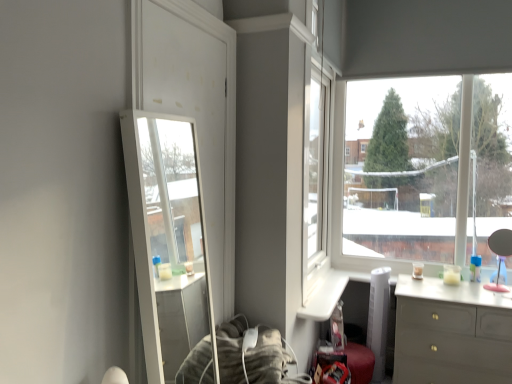
Question: Is clear glass mirror at left positioned far away from matte gray dresser at lower right?

Choices:
 (A) no
 (B) yes

Answer: (B)

Question: From the image's perspective, is clear glass mirror at left over matte gray dresser at lower right?

Choices:
 (A) no
 (B) yes

Answer: (B)

Question: Is clear glass mirror at left to the left of matte gray dresser at lower right from the viewer's perspective?

Choices:
 (A) yes
 (B) no

Answer: (A)

Question: Is clear glass mirror at left taller than matte gray dresser at lower right?

Choices:
 (A) yes
 (B) no

Answer: (A)

Question: Is clear glass mirror at left behind matte gray dresser at lower right?

Choices:
 (A) yes
 (B) no

Answer: (B)

Question: From the image's perspective, is clear glass mirror at left positioned above or below transparent glass window at upper right?

Choices:
 (A) below
 (B) above

Answer: (A)

Question: Looking at their shapes, would you say clear glass mirror at left is wider or thinner than transparent glass window at upper right?

Choices:
 (A) wide
 (B) thin

Answer: (B)

Question: Is clear glass mirror at left bigger or smaller than transparent glass window at upper right?

Choices:
 (A) big
 (B) small

Answer: (B)

Question: Considering the positions of point (177, 23) and point (452, 82), is point (177, 23) closer or farther from the camera than point (452, 82)?

Choices:
 (A) closer
 (B) farther

Answer: (A)

Question: From the image's perspective, relative to transparent glass window at upper right, is matte gray dresser at lower right above or below?

Choices:
 (A) below
 (B) above

Answer: (A)

Question: Is matte gray dresser at lower right bigger or smaller than transparent glass window at upper right?

Choices:
 (A) small
 (B) big

Answer: (B)

Question: In terms of height, does matte gray dresser at lower right look taller or shorter compared to transparent glass window at upper right?

Choices:
 (A) tall
 (B) short

Answer: (B)

Question: Is matte gray dresser at lower right in front of or behind transparent glass window at upper right in the image?

Choices:
 (A) front
 (B) behind

Answer: (A)

Question: From the image's perspective, is transparent glass window at upper right positioned above or below clear glass mirror at left?

Choices:
 (A) below
 (B) above

Answer: (B)

Question: Is transparent glass window at upper right situated inside clear glass mirror at left or outside?

Choices:
 (A) outside
 (B) inside

Answer: (A)